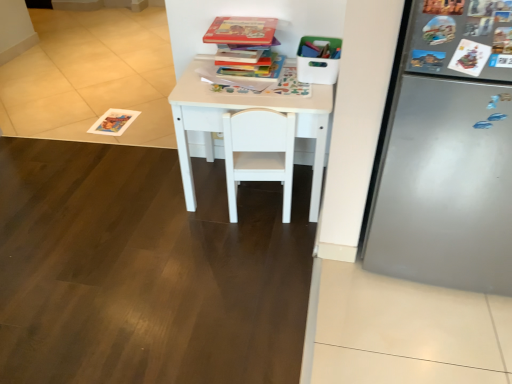
This screenshot has width=512, height=384. What are the coordinates of `white matte table at center` in the screenshot? It's located at (242, 109).

I want to click on hardcover book at center, marked as the first book in a bottom-to-top arrangement, so click(x=244, y=73).

Are hardcover book at upper center, the 1th book positioned from the top, and white matte chair at center far apart?

Actually, hardcover book at upper center, the 1th book positioned from the top, and white matte chair at center are a little close together.

Is hardcover book at upper center, the 1th book positioned from the top, closer to the viewer compared to white matte chair at center?

No, it is not.

Could you tell me if hardcover book at upper center, the 1th book positioned from the top, is turned towards white matte chair at center?

No.

From the picture: Considering the relative positions of hardcover book at upper center, the 3th book ordered from the bottom, and white matte chair at center in the image provided, is hardcover book at upper center, the 3th book ordered from the bottom, to the left of white matte chair at center from the viewer's perspective?

Yes.

Is hardcover book at upper center, which appears as the 2th book when ordered from the bottom, bigger than white matte chair at center?

No, hardcover book at upper center, which appears as the 2th book when ordered from the bottom, is not bigger than white matte chair at center.

Are hardcover book at upper center, which appears as the 2th book when ordered from the bottom, and white matte chair at center located far from each other?

No.

Which is correct: hardcover book at upper center, the second book viewed from the top, is inside white matte chair at center, or outside of it?

hardcover book at upper center, the second book viewed from the top, is outside white matte chair at center.

Which is more to the left, hardcover book at center, marked as the third book in a top-to-bottom arrangement, or white matte chair at center?

Positioned to the left is hardcover book at center, marked as the third book in a top-to-bottom arrangement.

Looking at this image, between hardcover book at center, marked as the third book in a top-to-bottom arrangement, and white matte chair at center, which one has larger size?

white matte chair at center is bigger.

Is hardcover book at center, marked as the third book in a top-to-bottom arrangement, located outside white matte chair at center?

Absolutely, hardcover book at center, marked as the third book in a top-to-bottom arrangement, is external to white matte chair at center.

From the image's perspective, is hardcover book at center, marked as the third book in a top-to-bottom arrangement, located above white matte chair at center?

Indeed, from the image's perspective, hardcover book at center, marked as the third book in a top-to-bottom arrangement, is shown above white matte chair at center.

From a real-world perspective, is hardcover book at center, marked as the first book in a bottom-to-top arrangement, positioned under hardcover book at upper center, the 3th book ordered from the bottom, based on gravity?

Yes.

From the image's perspective, is hardcover book at center, marked as the third book in a top-to-bottom arrangement, below hardcover book at upper center, the 3th book ordered from the bottom?

Yes.

Which of these two, hardcover book at center, marked as the first book in a bottom-to-top arrangement, or hardcover book at upper center, the 1th book positioned from the top, is wider?

hardcover book at upper center, the 1th book positioned from the top, is wider.

Looking at the image, does hardcover book at upper center, which appears as the 2th book when ordered from the bottom, seem bigger or smaller compared to white matte table at center?

In the image, hardcover book at upper center, which appears as the 2th book when ordered from the bottom, appears to be smaller than white matte table at center.

Is point (217, 52) closer or farther from the camera than point (200, 117)?

Point (217, 52) appears to be farther away from the viewer than point (200, 117).

Can you tell me how much hardcover book at upper center, the second book viewed from the top, and white matte table at center differ in facing direction?

3.29 degrees separate the facing orientations of hardcover book at upper center, the second book viewed from the top, and white matte table at center.

Which object is further away from the camera taking this photo, hardcover book at upper center, which appears as the 2th book when ordered from the bottom, or white matte table at center?

hardcover book at upper center, which appears as the 2th book when ordered from the bottom, is behind.

Is the position of white matte chair at center less distant than that of hardcover book at upper center, the 1th book positioned from the top?

Yes, white matte chair at center is closer to the camera.

How different are the orientations of white matte chair at center and hardcover book at upper center, the 1th book positioned from the top, in degrees?

174 degrees.

In terms of width, does white matte chair at center look wider or thinner when compared to hardcover book at upper center, the 1th book positioned from the top?

Considering their sizes, white matte chair at center looks broader than hardcover book at upper center, the 1th book positioned from the top.

Is white matte chair at center turned away from hardcover book at upper center, the 1th book positioned from the top?

white matte chair at center is not turned away from hardcover book at upper center, the 1th book positioned from the top.

Can you confirm if white matte chair at center is taller than hardcover book at center, marked as the first book in a bottom-to-top arrangement?

Yes, white matte chair at center is taller than hardcover book at center, marked as the first book in a bottom-to-top arrangement.

From a real-world perspective, which object stands above the other?

From a 3D spatial view, hardcover book at center, marked as the third book in a top-to-bottom arrangement, is above.

This screenshot has width=512, height=384. In order to click on chair located in front of the hardcover book at center, marked as the third book in a top-to-bottom arrangement in this screenshot , I will do `click(259, 152)`.

Is point (284, 132) positioned before point (273, 56)?

Yes, point (284, 132) is closer to viewer.

From the image's perspective, which book is the 3rd one above the white matte chair at center? Please provide its 2D coordinates.

[(242, 31)]

You are a GUI agent. You are given a task and a screenshot of the screen. Output one action in this format:
    pyautogui.click(x=<x>, y=<y>)
    Task: Click on the chair that appears in front of the hardcover book at upper center, the second book viewed from the top
    The width and height of the screenshot is (512, 384).
    Given the screenshot: What is the action you would take?
    pyautogui.click(x=259, y=152)

Looking at this image, based on their spatial positions, is hardcover book at center, marked as the first book in a bottom-to-top arrangement, or hardcover book at upper center, which appears as the 2th book when ordered from the bottom, further from white matte chair at center?

The object further to white matte chair at center is hardcover book at upper center, which appears as the 2th book when ordered from the bottom.

Looking at the image, which one is located further to white matte table at center, white matte chair at center or hardcover book at upper center, the second book viewed from the top?

The object further to white matte table at center is hardcover book at upper center, the second book viewed from the top.

Consider the image. From the image, which object appears to be farther from white matte table at center, hardcover book at upper center, the second book viewed from the top, or hardcover book at center, marked as the third book in a top-to-bottom arrangement?

Among the two, hardcover book at upper center, the second book viewed from the top, is located further to white matte table at center.

Which object lies further to the anchor point white matte chair at center, hardcover book at upper center, the 1th book positioned from the top, or hardcover book at center, marked as the third book in a top-to-bottom arrangement?

hardcover book at upper center, the 1th book positioned from the top.

Estimate the real-world distances between objects in this image. Which object is closer to white matte chair at center, hardcover book at center, marked as the third book in a top-to-bottom arrangement, or white matte table at center?

white matte table at center.

Consider the image. Based on their spatial positions, is hardcover book at upper center, the 3th book ordered from the bottom, or white matte chair at center closer to hardcover book at center, marked as the first book in a bottom-to-top arrangement?

hardcover book at upper center, the 3th book ordered from the bottom.

Looking at the image, which one is located closer to white matte chair at center, hardcover book at upper center, the 3th book ordered from the bottom, or hardcover book at upper center, which appears as the 2th book when ordered from the bottom?

hardcover book at upper center, which appears as the 2th book when ordered from the bottom, lies closer to white matte chair at center than the other object.

When comparing their distances from hardcover book at upper center, the 3th book ordered from the bottom, does white matte table at center or white matte chair at center seem closer?

Based on the image, white matte table at center appears to be nearer to hardcover book at upper center, the 3th book ordered from the bottom.

Find the location of a particular element. The height and width of the screenshot is (384, 512). table between hardcover book at center, marked as the first book in a bottom-to-top arrangement, and white matte chair at center from top to bottom is located at coordinates (242, 109).

Where is `table between hardcover book at upper center, the 1th book positioned from the top, and white matte chair at center in the up-down direction`? The width and height of the screenshot is (512, 384). table between hardcover book at upper center, the 1th book positioned from the top, and white matte chair at center in the up-down direction is located at coordinates tap(242, 109).

Identify the location of book that lies between hardcover book at upper center, the 3th book ordered from the bottom, and hardcover book at center, marked as the first book in a bottom-to-top arrangement, from top to bottom. Image resolution: width=512 pixels, height=384 pixels. (242, 53).

Where is `book between hardcover book at upper center, the second book viewed from the top, and white matte table at center vertically`? The height and width of the screenshot is (384, 512). book between hardcover book at upper center, the second book viewed from the top, and white matte table at center vertically is located at coordinates (244, 73).